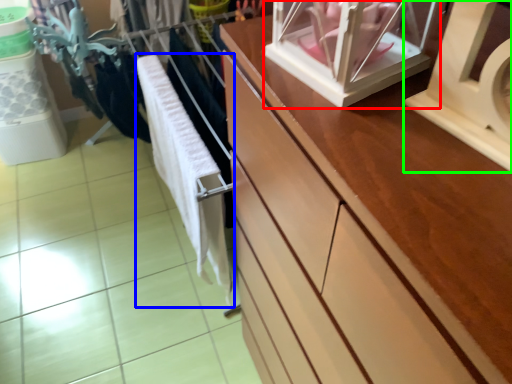
Question: Which object is the farthest from glass box (highlighted by a red box)? Choose among these: baby clothe (highlighted by a blue box) or wide (highlighted by a green box).

Choices:
 (A) baby clothe
 (B) wide

Answer: (A)